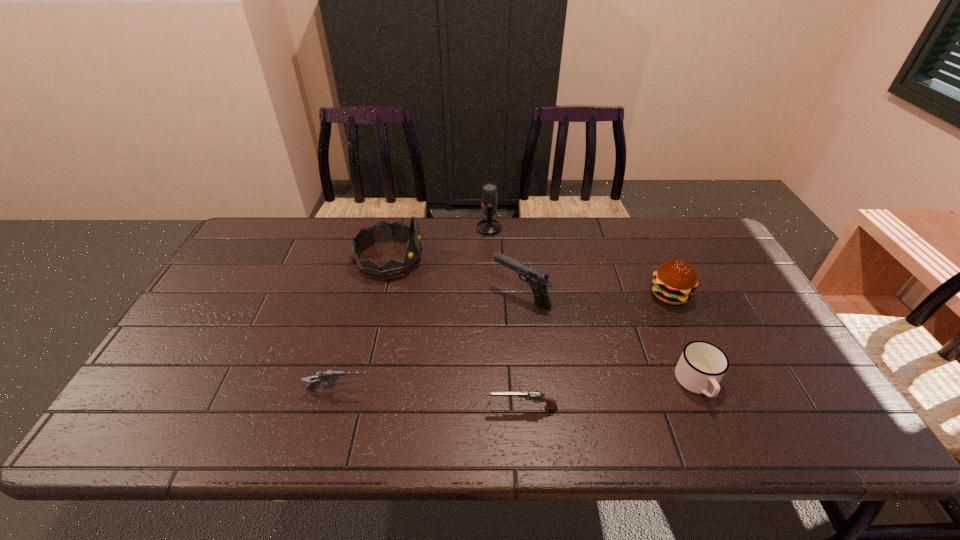
Identify the location of free point between the shortest gun and the mug. (611, 396).

Select which object appears as the fifth closest to the tiara. Please provide its 2D coordinates. Your answer should be formatted as a tuple, i.e. [(x, y)], where the tuple contains the x and y coordinates of a point satisfying the conditions above.

[(674, 281)]

You are a GUI agent. You are given a task and a screenshot of the screen. Output one action in this format:
    pyautogui.click(x=<x>, y=<y>)
    Task: Click on the object that is the third closest to the farthest object
    This screenshot has height=540, width=960.
    Given the screenshot: What is the action you would take?
    pyautogui.click(x=674, y=281)

Identify which gun is the second nearest to the farthest object. Please provide its 2D coordinates. Your answer should be formatted as a tuple, i.e. [(x, y)], where the tuple contains the x and y coordinates of a point satisfying the conditions above.

[(536, 396)]

Where is `the second closest gun to the tiara`? The image size is (960, 540). the second closest gun to the tiara is located at coordinates (330, 377).

Locate an element on the screen. free space that satisfies the following two spatial constraints: 1. at the front of the hamburger with jewels; 2. on the right side of the tiara is located at coordinates (381, 294).

You are a GUI agent. You are given a task and a screenshot of the screen. Output one action in this format:
    pyautogui.click(x=<x>, y=<y>)
    Task: Click on the free location that satisfies the following two spatial constraints: 1. on the side of the mug with the handle; 2. at the barrel of the second nearest gun
    The width and height of the screenshot is (960, 540).
    Given the screenshot: What is the action you would take?
    pyautogui.click(x=701, y=392)